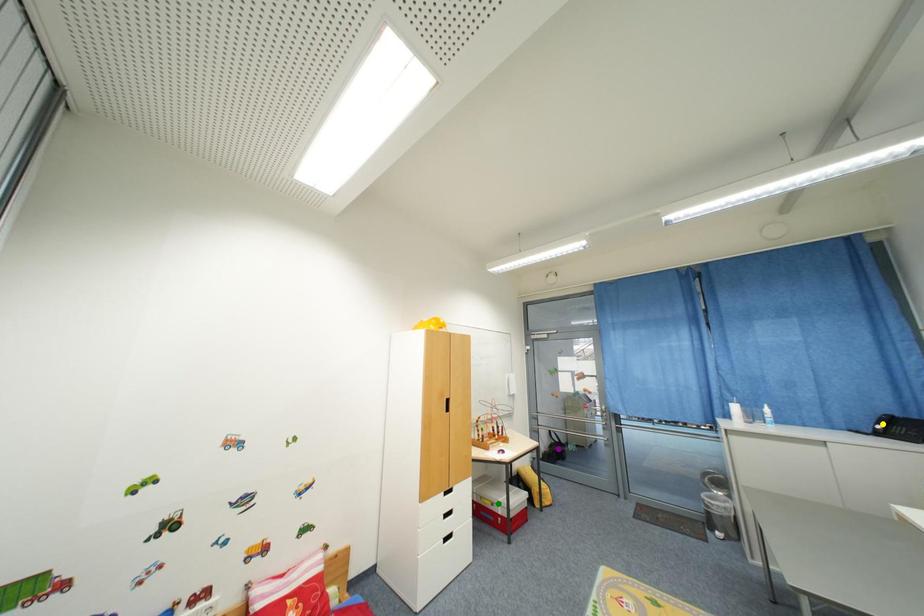
Order these from nearest to farthest:
A) green point
B) yellow point
C) purple point

yellow point < green point < purple point